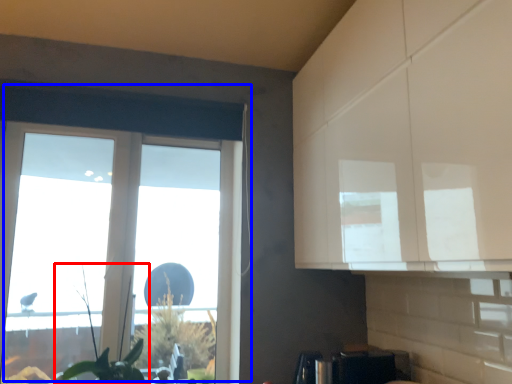
Question: Which object is closer to the camera taking this photo, plant (highlighted by a red box) or window (highlighted by a blue box)?

Choices:
 (A) plant
 (B) window

Answer: (A)